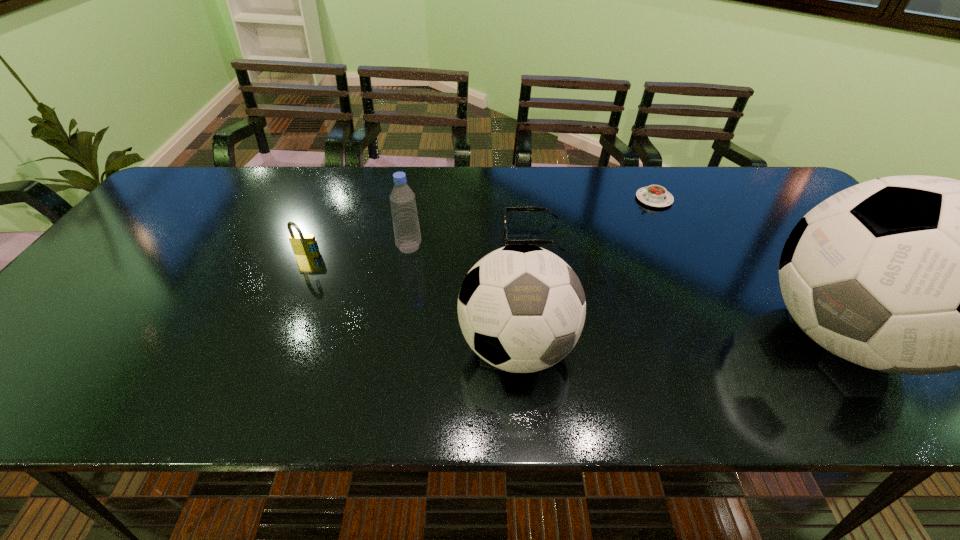
Observe the arrangement of all soccer balls in the image. To keep them evenly spaced, where would you place another soccer ball on the left? Please locate a free space. Please provide its 2D coordinates. Your answer should be formatted as a tuple, i.e. [(x, y)], where the tuple contains the x and y coordinates of a point satisfying the conditions above.

[(177, 359)]